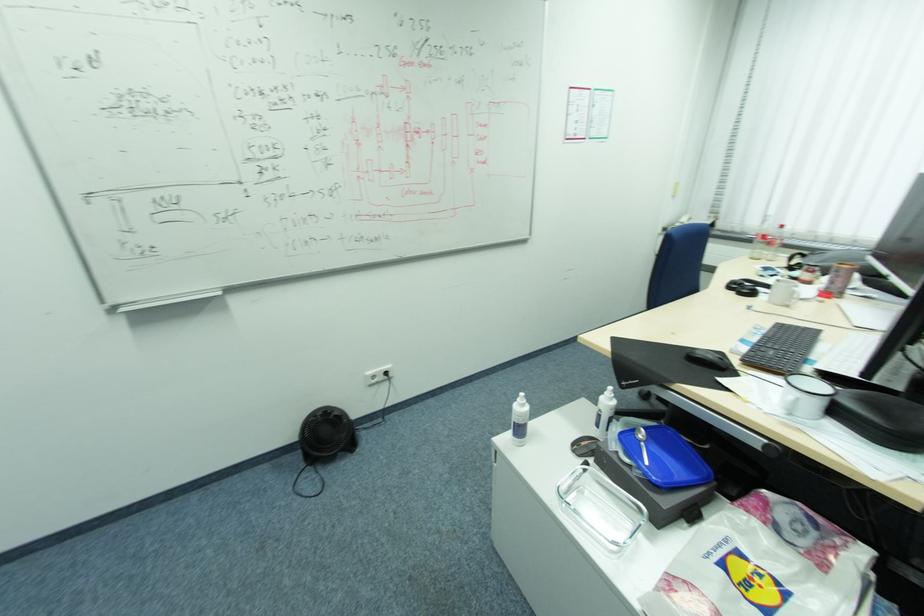
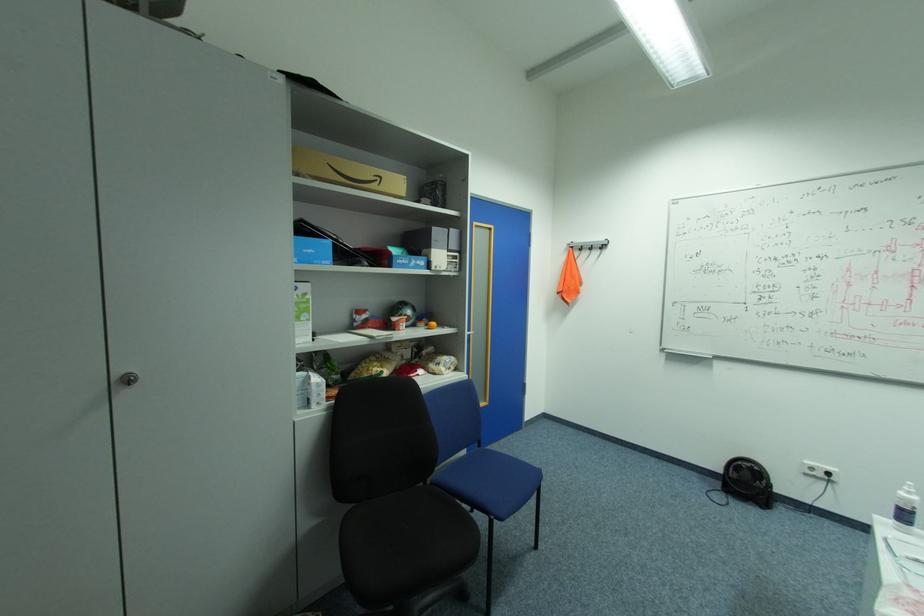
Find the pixel in the second image that matches [529,405] in the first image.

(916, 493)